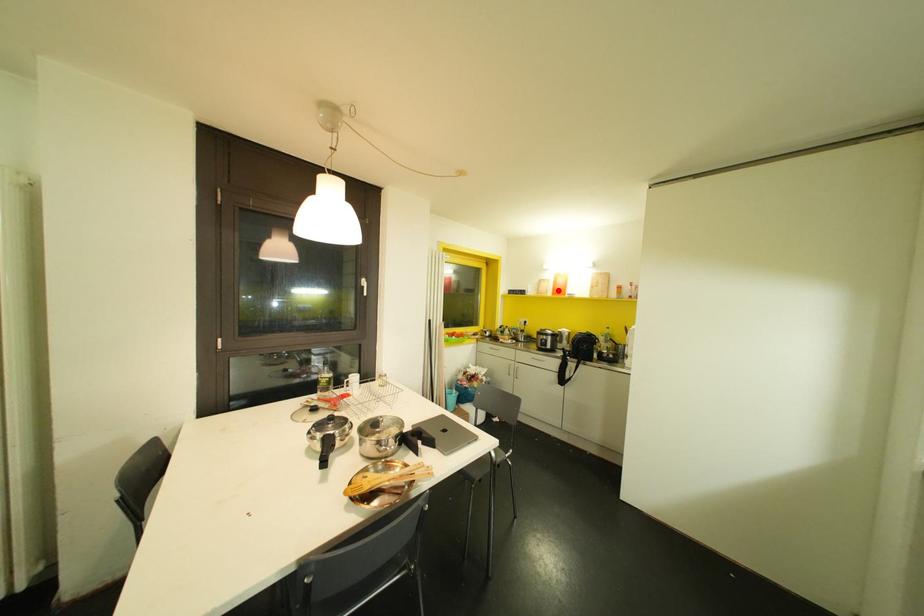
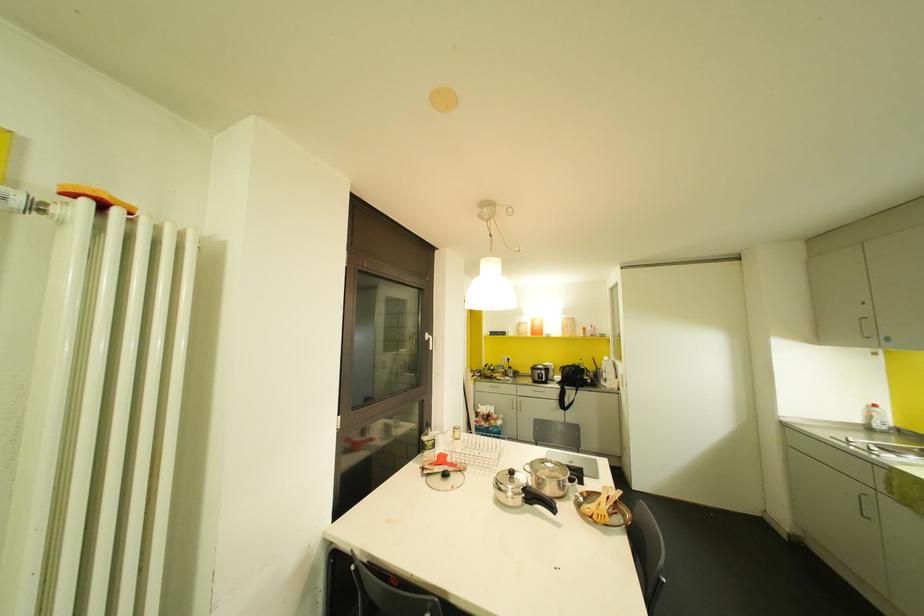
Question: I am providing you with two images of the same scene from different viewpoints. Image1 has a red point marked. In image2, the corresponding 3D location appears at what relative position? Reply with the corresponding letter.

Choices:
 (A) Closer
 (B) Farther

Answer: (B)